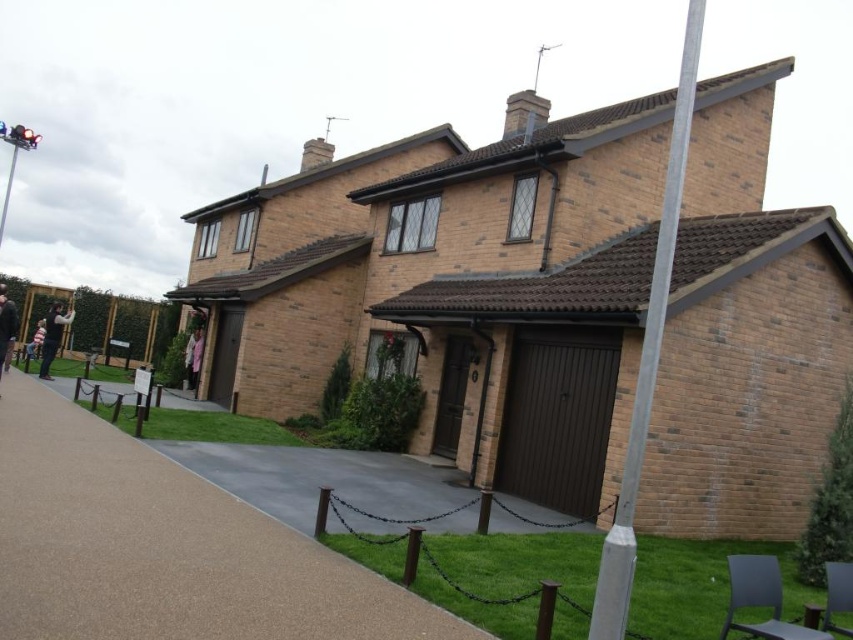
Question: Among these points, which one is nearest to the camera?

Choices:
 (A) (169, 540)
 (B) (599, 598)

Answer: (B)

Question: Does brown asphalt pavement at center appear on the left side of silver metallic pole at upper right?

Choices:
 (A) no
 (B) yes

Answer: (B)

Question: Is brown asphalt pavement at center positioned behind silver metallic pole at upper right?

Choices:
 (A) yes
 (B) no

Answer: (B)

Question: Can you confirm if brown asphalt pavement at center is smaller than silver metallic pole at upper right?

Choices:
 (A) yes
 (B) no

Answer: (A)

Question: Which point appears closest to the camera in this image?

Choices:
 (A) (604, 589)
 (B) (235, 589)

Answer: (A)